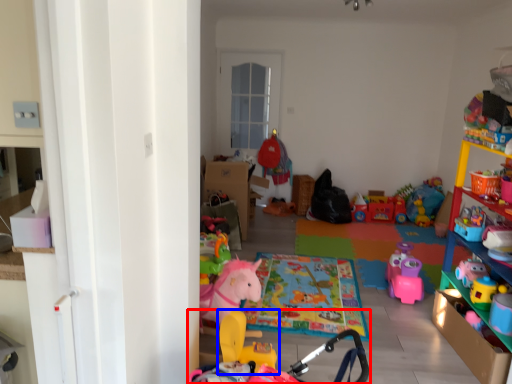
Question: Which object is further to the camera taking this photo, toy (highlighted by a red box) or toy (highlighted by a blue box)?

Choices:
 (A) toy
 (B) toy

Answer: (B)